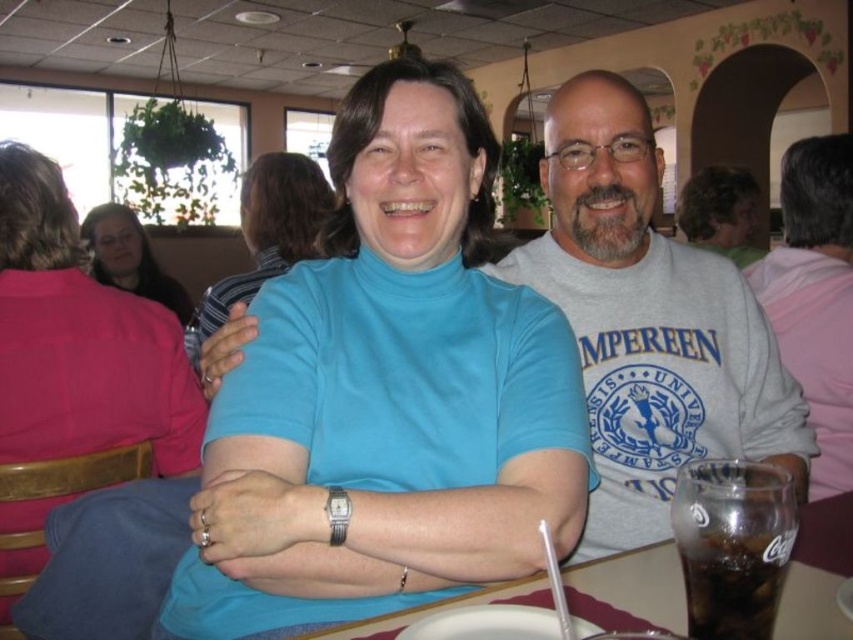
You are a photographer trying to capture a closeup of the matte blue turtleneck at center and the blue turtleneck sweater at center. Which one is located to the left of the other?

The matte blue turtleneck at center is positioned on the left side of blue turtleneck sweater at center.

You are a photographer standing in the dining area and want to capture both the gray cotton sweatshirt at center and the gray cotton shirt at upper right in the same frame. Which object should you focus on first to ensure both are in the shot?

The gray cotton sweatshirt at center is located below the gray cotton shirt at upper right, so you should focus on the gray cotton shirt at upper right first to ensure both are in the frame.